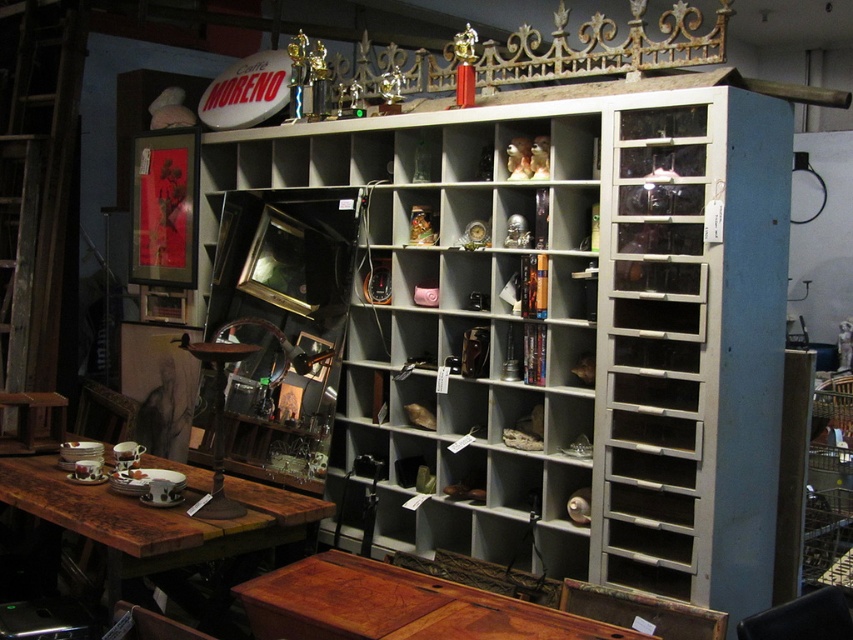
Can you confirm if white painted wood bookshelf at center is positioned below wooden polished table at lower center?

Actually, white painted wood bookshelf at center is above wooden polished table at lower center.

Which is more to the right, white painted wood bookshelf at center or wooden polished table at lower center?

From the viewer's perspective, white painted wood bookshelf at center appears more on the right side.

The image size is (853, 640). Identify the location of white painted wood bookshelf at center. (570, 333).

Is wooden polished table at lower center closer to the viewer compared to rustic wood table at lower left?

Yes, it is in front of rustic wood table at lower left.

You are a GUI agent. You are given a task and a screenshot of the screen. Output one action in this format:
    pyautogui.click(x=<x>, y=<y>)
    Task: Click on the wooden polished table at lower center
    
    Given the screenshot: What is the action you would take?
    (396, 605)

In order to click on wooden polished table at lower center in this screenshot , I will do `click(396, 605)`.

Can you confirm if white painted wood bookshelf at center is positioned to the left of rustic wood table at lower left?

In fact, white painted wood bookshelf at center is to the right of rustic wood table at lower left.

Is point (590, 452) closer to viewer compared to point (112, 536)?

That is False.

Locate an element on the screen. white painted wood bookshelf at center is located at coordinates (570, 333).